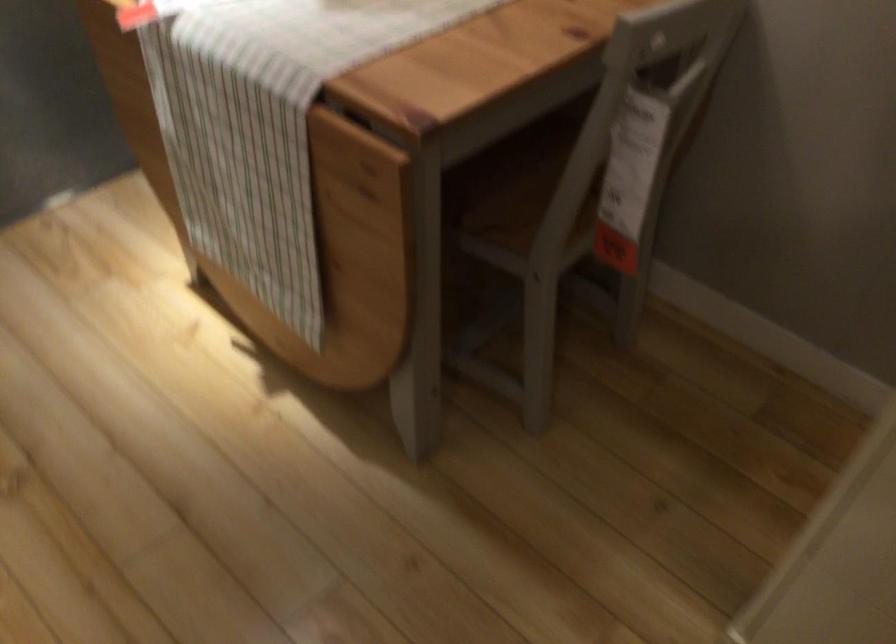
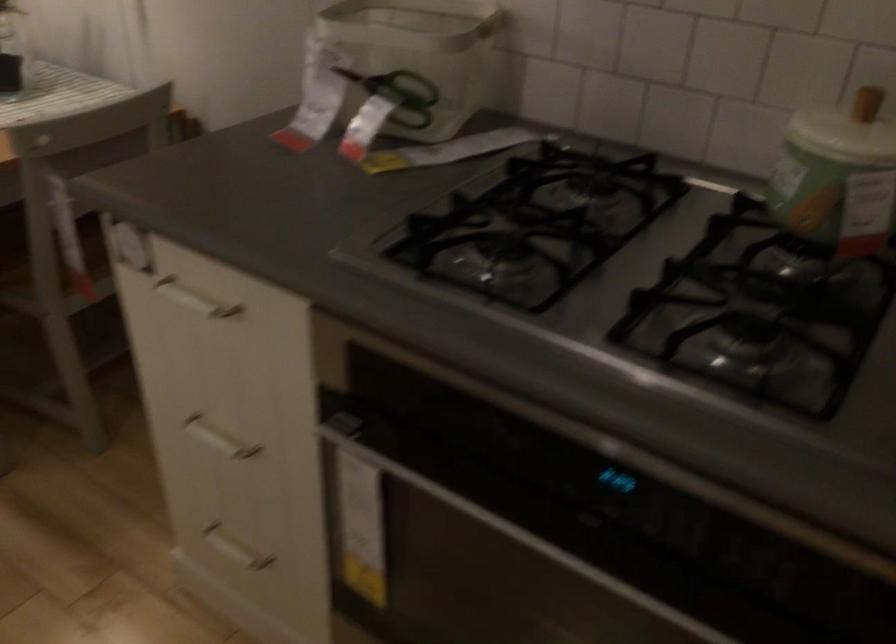
Where in the second image is the point corresponding to point (582, 223) from the first image?

(54, 270)